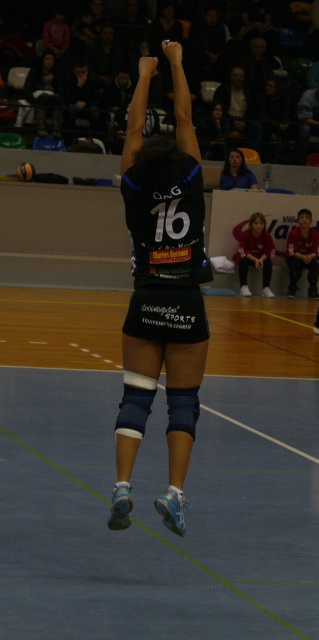
You are a photographer standing at the baseline of the volleyball court. You want to take a clear photo of the smooth skin face at upper center. Considering the distance between you and the face, is it feasible to capture a detailed closeup without using a zoom lens?

The smooth skin face at upper center is 67.59 feet away from the viewer. Without a zoom lens, capturing a detailed closeup from this distance would be challenging as the subject would appear small in the frame. A zoom lens would be necessary to achieve a clear, detailed closeup.